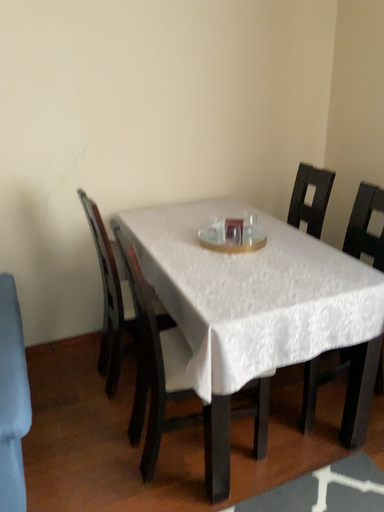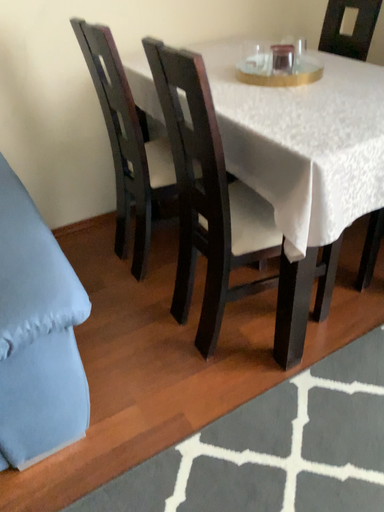
Question: Which way did the camera rotate in the video?

Choices:
 (A) rotated downward
 (B) rotated upward

Answer: (A)